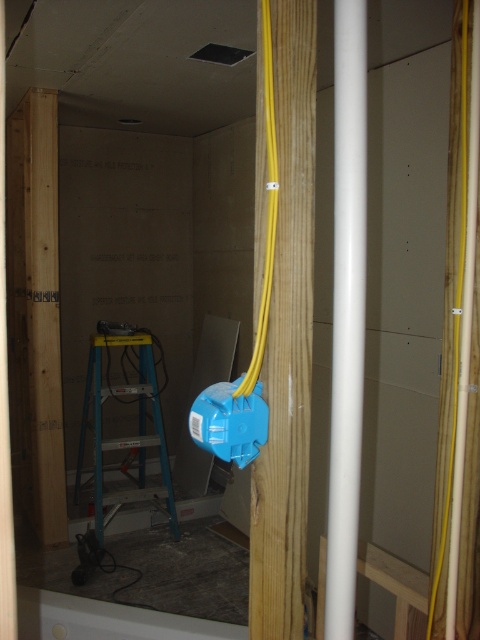
Question: Which object is farther from the camera taking this photo?

Choices:
 (A) blue plastic ladder at center
 (B) white smooth pipe at center
 (C) yellow wood pillar at center
 (D) yellow rubber cable at center

Answer: (A)

Question: Which of the following is the farthest from the observer?

Choices:
 (A) (328, 496)
 (B) (312, 108)
 (C) (267, 154)

Answer: (A)

Question: Can you confirm if yellow wood pillar at center is smaller than white smooth pipe at center?

Choices:
 (A) no
 (B) yes

Answer: (A)

Question: Can you confirm if yellow wood pillar at center is bigger than white smooth pipe at center?

Choices:
 (A) yes
 (B) no

Answer: (A)

Question: Can you confirm if yellow wood pillar at center is bigger than white smooth pipe at center?

Choices:
 (A) yes
 (B) no

Answer: (A)

Question: Which point is farther to the camera?

Choices:
 (A) (269, 67)
 (B) (155, 413)

Answer: (B)